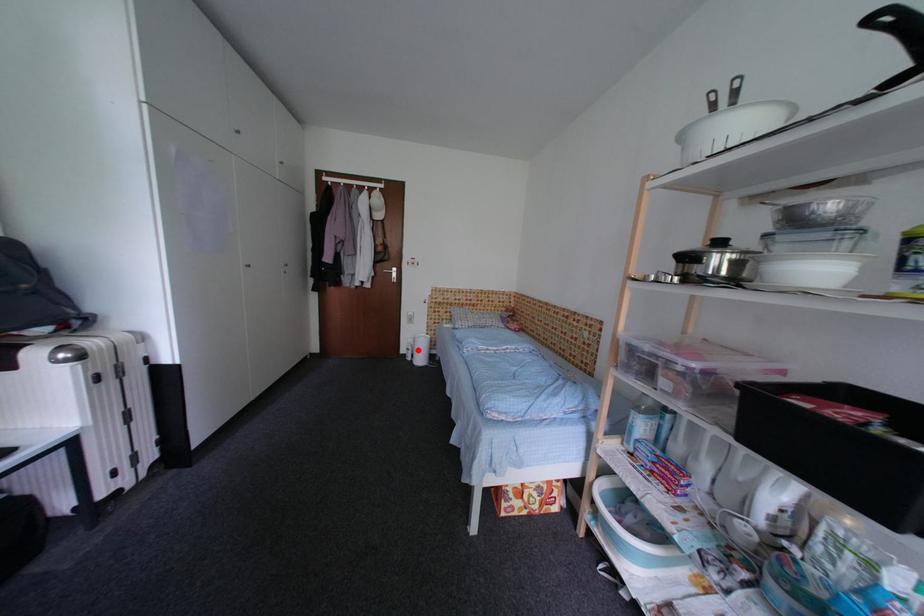
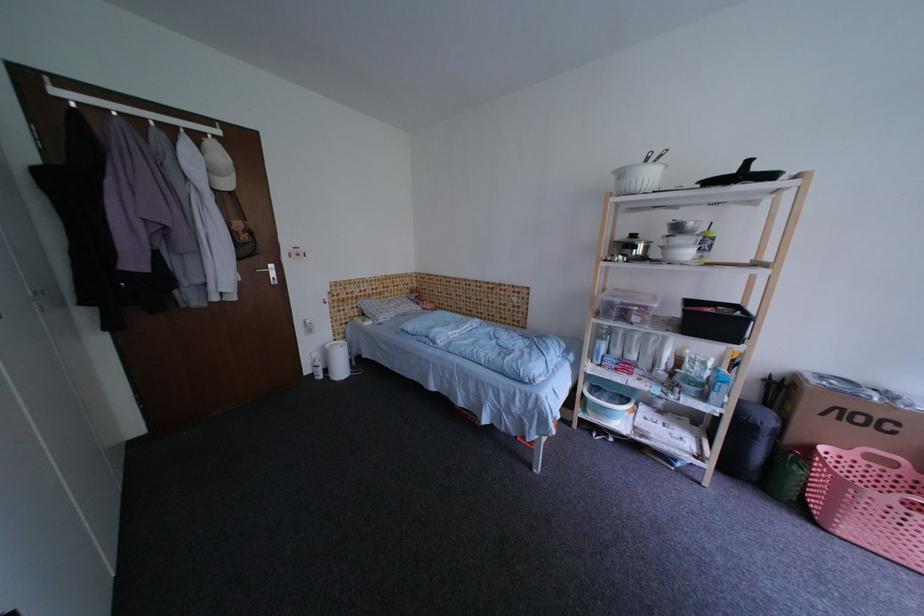
Question: I am providing you with two images of the same scene from different viewpoints. In image1, a red point is highlighted. Considering the same 3D point in image2, which of the following is correct?

Choices:
 (A) It is closer
 (B) It is farther

Answer: (A)